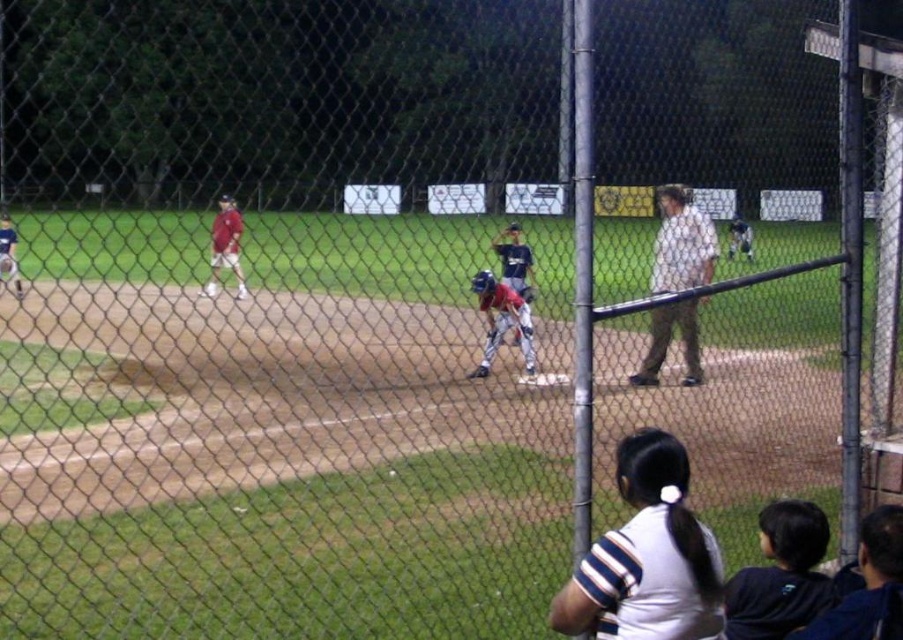
In the scene shown: You are standing at the center of the baseball field and want to locate the dark blue shirt at lower right. Which direction should you face to see it?

You should face towards the lower right direction to see the dark blue shirt at lower right.

You are a photographer trying to capture a shot of both the light brown cotton shirt at center and the matte red baseball uniform at left. Considering their sizes, which one might appear smaller in the photo?

The light brown cotton shirt at center has a lesser width compared to the matte red baseball uniform at left, so it would appear smaller in the photo.

You are a photographer trying to capture a photo of the dark blue shirt at lower right and the matte red baseball uniform at left. Which object appears narrower in the photo?

The dark blue shirt at lower right appears narrower in the photo compared to the matte red baseball uniform at left as it has a lesser width.